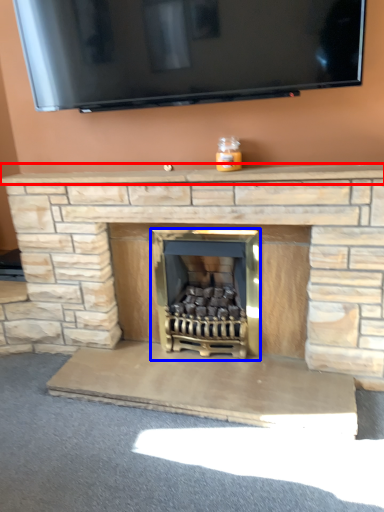
Question: Which object is further to the camera taking this photo, mantle (highlighted by a red box) or wood burning stove (highlighted by a blue box)?

Choices:
 (A) mantle
 (B) wood burning stove

Answer: (B)